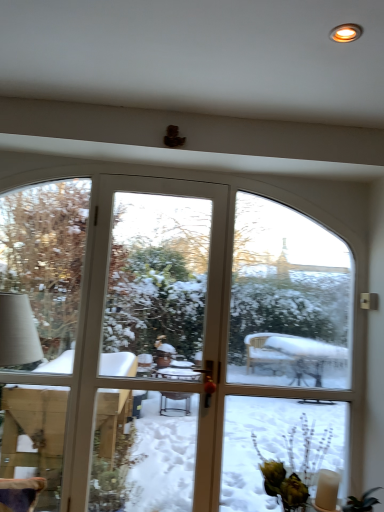
Question: Is there a large distance between matte gold light at upper right and green leafy plant at lower right?

Choices:
 (A) no
 (B) yes

Answer: (B)

Question: From a real-world perspective, is matte gold light at upper right located beneath green leafy plant at lower right?

Choices:
 (A) no
 (B) yes

Answer: (A)

Question: Does matte gold light at upper right have a greater height compared to green leafy plant at lower right?

Choices:
 (A) yes
 (B) no

Answer: (B)

Question: Considering the relative positions of matte gold light at upper right and green leafy plant at lower right in the image provided, is matte gold light at upper right to the left of green leafy plant at lower right from the viewer's perspective?

Choices:
 (A) no
 (B) yes

Answer: (B)

Question: Does matte gold light at upper right turn towards green leafy plant at lower right?

Choices:
 (A) yes
 (B) no

Answer: (B)

Question: Is matte gold light at upper right shorter than green leafy plant at lower right?

Choices:
 (A) no
 (B) yes

Answer: (B)

Question: From a real-world perspective, does green leafy plant at lower right stand above clear glass screen door at center?

Choices:
 (A) yes
 (B) no

Answer: (B)

Question: From a real-world perspective, does green leafy plant at lower right sit lower than clear glass screen door at center?

Choices:
 (A) no
 (B) yes

Answer: (B)

Question: From the image's perspective, is green leafy plant at lower right above clear glass screen door at center?

Choices:
 (A) no
 (B) yes

Answer: (A)

Question: Is green leafy plant at lower right looking in the opposite direction of clear glass screen door at center?

Choices:
 (A) no
 (B) yes

Answer: (B)

Question: Is green leafy plant at lower right completely or partially outside of clear glass screen door at center?

Choices:
 (A) yes
 (B) no

Answer: (A)

Question: Does green leafy plant at lower right have a smaller size compared to clear glass screen door at center?

Choices:
 (A) yes
 (B) no

Answer: (B)

Question: Can you confirm if clear glass screen door at center is taller than green leafy plant at lower right?

Choices:
 (A) yes
 (B) no

Answer: (A)